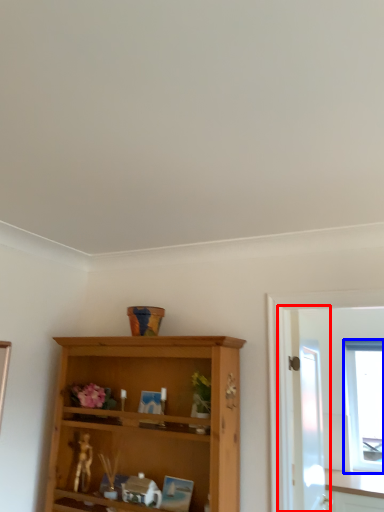
Question: Among these objects, which one is nearest to the camera, screen door (highlighted by a red box) or window (highlighted by a blue box)?

Choices:
 (A) screen door
 (B) window

Answer: (A)